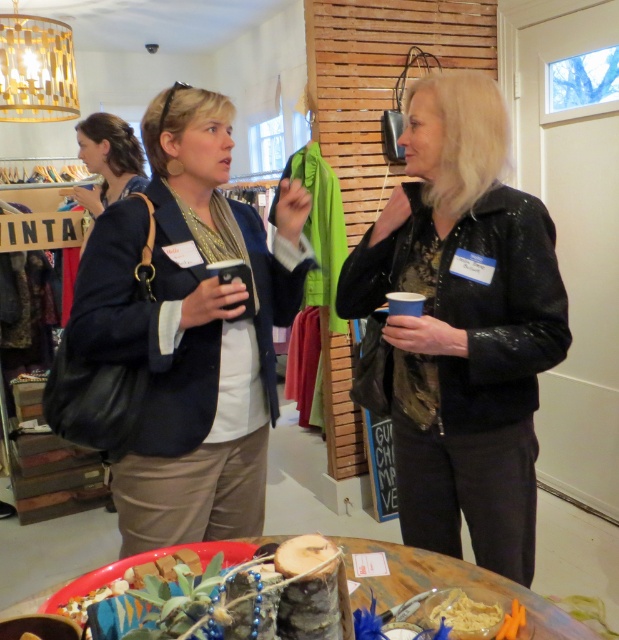
Question: From the image, what is the correct spatial relationship of black sequined jacket at center in relation to matte black blazer at left?

Choices:
 (A) right
 (B) left

Answer: (A)

Question: Estimate the real-world distances between objects in this image. Which object is farther from the wooden log at center?

Choices:
 (A) matte black blazer at left
 (B) black sequined jacket at center

Answer: (A)

Question: Does black sequined jacket at center come in front of matte black purse at upper left?

Choices:
 (A) yes
 (B) no

Answer: (A)

Question: Can you confirm if matte black blazer at left is positioned above matte black purse at upper left?

Choices:
 (A) yes
 (B) no

Answer: (B)

Question: Which of the following is the farthest from the observer?

Choices:
 (A) wooden log at center
 (B) matte black blazer at left
 (C) black sequined jacket at center
 (D) matte black purse at upper left

Answer: (D)

Question: Estimate the real-world distances between objects in this image. Which object is farther from the matte black purse at upper left?

Choices:
 (A) wooden log at center
 (B) matte black blazer at left
 (C) black sequined jacket at center

Answer: (A)